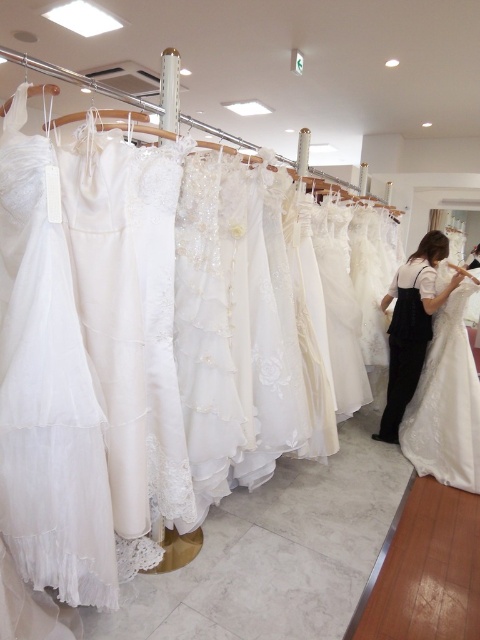
Question: Is satin white gown at right positioned behind white satin dress at center?

Choices:
 (A) yes
 (B) no

Answer: (B)

Question: Does satin white gown at right have a greater width compared to white satin dress at center?

Choices:
 (A) no
 (B) yes

Answer: (A)

Question: Which point is farther to the camera?

Choices:
 (A) (411, 280)
 (B) (436, 310)

Answer: (A)

Question: Which point is closer to the camera taking this photo?

Choices:
 (A) (418, 259)
 (B) (454, 451)

Answer: (B)

Question: Is satin white gown at right closer to the viewer compared to white satin dress at center?

Choices:
 (A) no
 (B) yes

Answer: (B)

Question: Which object appears closest to the camera in this image?

Choices:
 (A) white satin dress at center
 (B) satin white gown at right

Answer: (B)